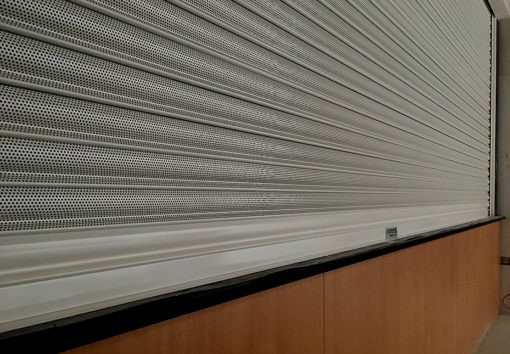
You are a GUI agent. You are given a task and a screenshot of the screen. Output one action in this format:
    pyautogui.click(x=<x>, y=<y>)
    Task: Click on the cord
    Image resolution: width=510 pixels, height=354 pixels.
    Given the screenshot: What is the action you would take?
    pyautogui.click(x=506, y=298)